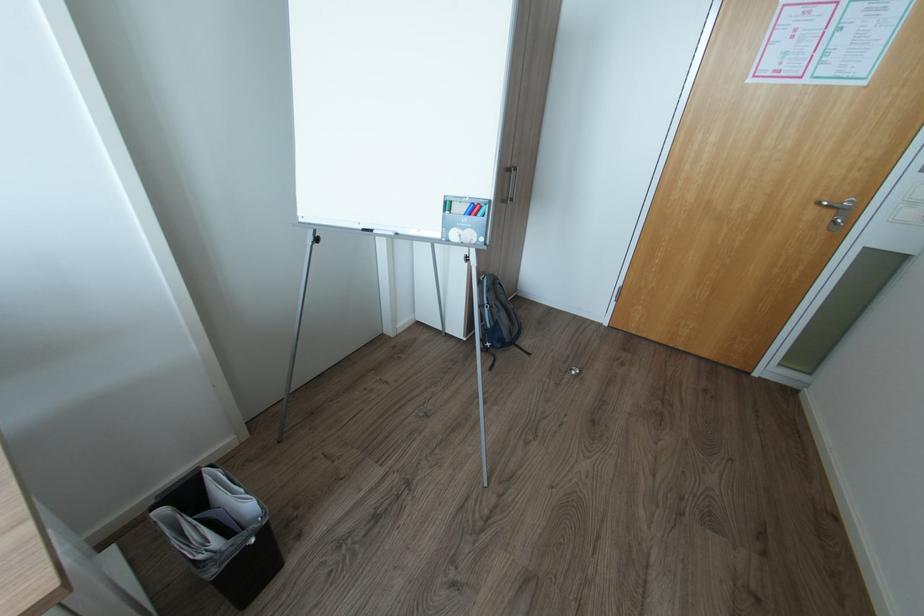
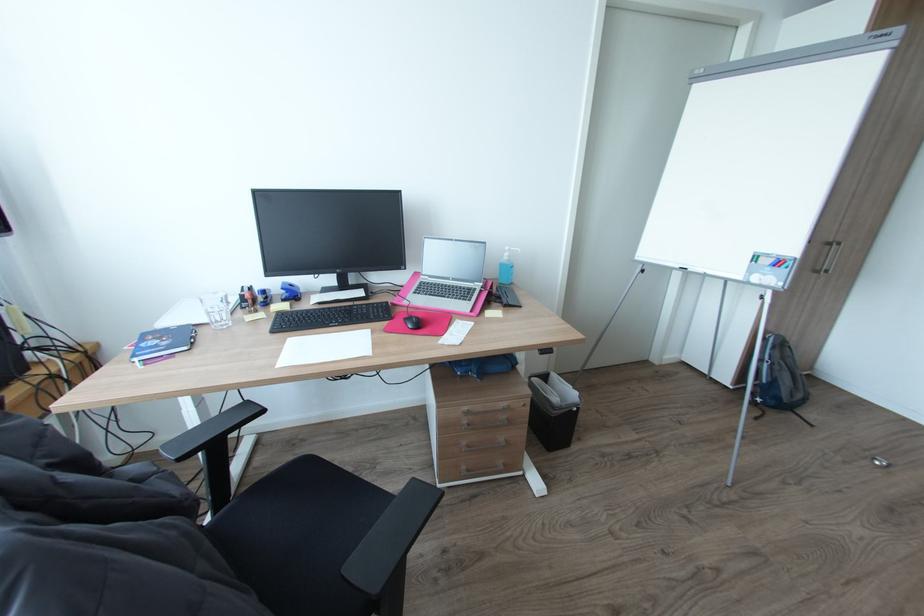
Question: The images are taken continuously from a first-person perspective. In which direction is your viewpoint rotating?

Choices:
 (A) Left
 (B) Right
 (C) Up
 (D) Down

Answer: (A)